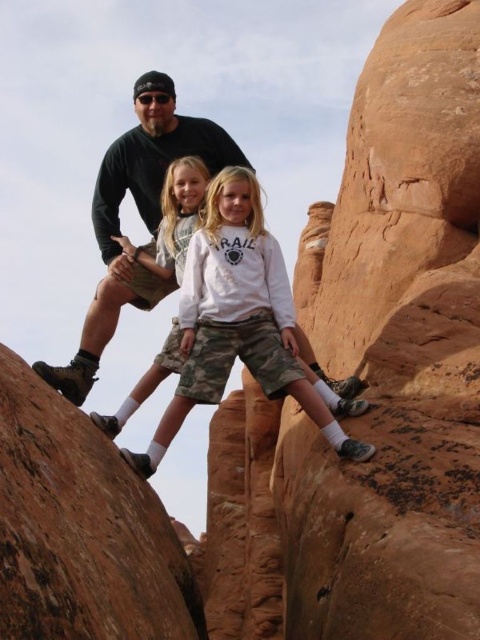
Who is more distant from viewer, (x=156, y=205) or (x=154, y=358)?

The point (x=154, y=358) is more distant.

Identify the location of dark green t-shirt at center. (140, 214).

I want to click on dark green t-shirt at center, so click(x=140, y=214).

This screenshot has height=640, width=480. What do you see at coordinates (395, 352) in the screenshot? I see `rustic sandstone arch at right` at bounding box center [395, 352].

In the scene shown: Can you confirm if rustic sandstone arch at right is taller than brown rough rock at upper left?

Indeed, rustic sandstone arch at right has a greater height compared to brown rough rock at upper left.

Between point (436, 266) and point (170, 602), which one is positioned in front?

Point (170, 602) is in front.

Locate an element on the screen. The width and height of the screenshot is (480, 640). rustic sandstone arch at right is located at coordinates (395, 352).

Can you confirm if rustic sandstone arch at right is shorter than dark green t-shirt at center?

Incorrect, rustic sandstone arch at right's height does not fall short of dark green t-shirt at center's.

Find the location of a particular element. Image resolution: width=480 pixels, height=640 pixels. rustic sandstone arch at right is located at coordinates (395, 352).